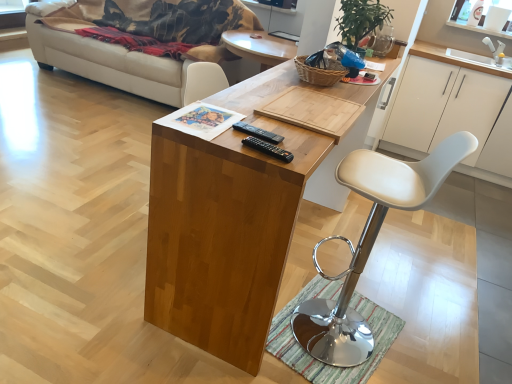
Question: Does white leather stool at center have a greater height compared to white matte cabinet at right?

Choices:
 (A) yes
 (B) no

Answer: (A)

Question: Is white leather stool at center next to white matte cabinet at right and touching it?

Choices:
 (A) no
 (B) yes

Answer: (A)

Question: Can you confirm if white leather stool at center is thinner than white matte cabinet at right?

Choices:
 (A) yes
 (B) no

Answer: (A)

Question: Could white matte cabinet at right be considered to be inside white leather stool at center?

Choices:
 (A) no
 (B) yes

Answer: (A)

Question: Is white leather stool at center positioned behind white matte cabinet at right?

Choices:
 (A) yes
 (B) no

Answer: (B)

Question: Considering the positions of white matte cabinet at right and striped fabric mat at lower center in the image, is white matte cabinet at right wider or thinner than striped fabric mat at lower center?

Choices:
 (A) thin
 (B) wide

Answer: (B)

Question: Considering the positions of white matte cabinet at right and striped fabric mat at lower center in the image, is white matte cabinet at right bigger or smaller than striped fabric mat at lower center?

Choices:
 (A) small
 (B) big

Answer: (B)

Question: Considering the positions of point (434, 56) and point (304, 360), is point (434, 56) closer or farther from the camera than point (304, 360)?

Choices:
 (A) farther
 (B) closer

Answer: (A)

Question: From the image's perspective, is white matte cabinet at right positioned above or below striped fabric mat at lower center?

Choices:
 (A) above
 (B) below

Answer: (A)

Question: Considering the positions of white matte cabinet at right and wooden desk at center in the image, is white matte cabinet at right wider or thinner than wooden desk at center?

Choices:
 (A) wide
 (B) thin

Answer: (A)

Question: From their relative heights in the image, would you say white matte cabinet at right is taller or shorter than wooden desk at center?

Choices:
 (A) tall
 (B) short

Answer: (B)

Question: Considering the positions of white matte cabinet at right and wooden desk at center in the image, is white matte cabinet at right bigger or smaller than wooden desk at center?

Choices:
 (A) small
 (B) big

Answer: (A)

Question: Visually, is white matte cabinet at right positioned to the left or to the right of wooden desk at center?

Choices:
 (A) right
 (B) left

Answer: (A)

Question: Considering their positions, is white leather stool at center located in front of or behind beige fabric couch at left?

Choices:
 (A) behind
 (B) front

Answer: (B)

Question: In terms of width, does white leather stool at center look wider or thinner when compared to beige fabric couch at left?

Choices:
 (A) thin
 (B) wide

Answer: (A)